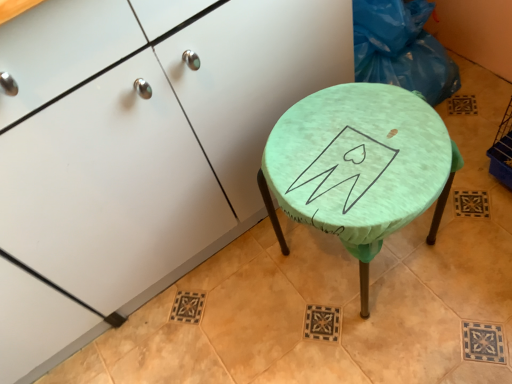
Locate an element on the screen. matte white cabinet at center is located at coordinates (148, 131).

I want to click on matte white cabinet at center, so click(148, 131).

Considering the relative sizes of blue plastic bag at upper right and green fabric-covered stool at center in the image provided, is blue plastic bag at upper right shorter than green fabric-covered stool at center?

Yes.

Is blue plastic bag at upper right inside or outside of green fabric-covered stool at center?

blue plastic bag at upper right is outside green fabric-covered stool at center.

From a real-world perspective, between blue plastic bag at upper right and green fabric-covered stool at center, who is vertically higher?

blue plastic bag at upper right.

This screenshot has height=384, width=512. Find the location of `garbage that is on the right side of matte white cabinet at center`. garbage that is on the right side of matte white cabinet at center is located at coordinates (401, 49).

Is blue plastic bag at upper right directly adjacent to matte white cabinet at center?

No, blue plastic bag at upper right is not touching matte white cabinet at center.

Is blue plastic bag at upper right bigger or smaller than matte white cabinet at center?

Considering their sizes, blue plastic bag at upper right takes up less space than matte white cabinet at center.

Is blue plastic bag at upper right positioned behind matte white cabinet at center?

Yes.

Considering the sizes of objects green fabric-covered stool at center and blue plastic bag at upper right in the image provided, who is thinner, green fabric-covered stool at center or blue plastic bag at upper right?

blue plastic bag at upper right.

Based on the photo, between green fabric-covered stool at center and blue plastic bag at upper right, which one has smaller size?

blue plastic bag at upper right is smaller.

Does point (393, 193) come in front of point (432, 75)?

Yes.

Is green fabric-covered stool at center facing towards blue plastic bag at upper right?

No, green fabric-covered stool at center does not turn towards blue plastic bag at upper right.

From a real-world perspective, between matte white cabinet at center and blue plastic bag at upper right, who is vertically lower?

In real-world perspective, blue plastic bag at upper right is lower.

Considering the sizes of objects matte white cabinet at center and blue plastic bag at upper right in the image provided, who is shorter, matte white cabinet at center or blue plastic bag at upper right?

blue plastic bag at upper right.

Considering their positions, is matte white cabinet at center located in front of or behind blue plastic bag at upper right?

matte white cabinet at center is in front of blue plastic bag at upper right.

Can you confirm if green fabric-covered stool at center is wider than matte white cabinet at center?

Incorrect, the width of green fabric-covered stool at center does not surpass that of matte white cabinet at center.

Can you confirm if green fabric-covered stool at center is shorter than matte white cabinet at center?

Indeed, green fabric-covered stool at center has a lesser height compared to matte white cabinet at center.

From a real-world perspective, between green fabric-covered stool at center and matte white cabinet at center, who is vertically lower?

green fabric-covered stool at center, from a real-world perspective.

From the image's perspective, is green fabric-covered stool at center located above or below matte white cabinet at center?

green fabric-covered stool at center is below matte white cabinet at center.

Is matte white cabinet at center bigger than green fabric-covered stool at center?

Correct, matte white cabinet at center is larger in size than green fabric-covered stool at center.

Consider the image. Considering the relative positions of matte white cabinet at center and green fabric-covered stool at center in the image provided, is matte white cabinet at center to the right of green fabric-covered stool at center from the viewer's perspective?

In fact, matte white cabinet at center is to the left of green fabric-covered stool at center.

Would you consider matte white cabinet at center to be distant from green fabric-covered stool at center?

They are positioned close to each other.

From a real-world perspective, between matte white cabinet at center and green fabric-covered stool at center, who is vertically higher?

matte white cabinet at center is physically above.

In order to click on garbage that is above the green fabric-covered stool at center (from a real-world perspective) in this screenshot , I will do `click(401, 49)`.

I want to click on cabinetry in front of the blue plastic bag at upper right, so click(148, 131).

When comparing their distances from blue plastic bag at upper right, does green fabric-covered stool at center or matte white cabinet at center seem closer?

Based on the image, green fabric-covered stool at center appears to be nearer to blue plastic bag at upper right.

Estimate the real-world distances between objects in this image. Which object is closer to blue plastic bag at upper right, matte white cabinet at center or green fabric-covered stool at center?

Among the two, green fabric-covered stool at center is located nearer to blue plastic bag at upper right.

Estimate the real-world distances between objects in this image. Which object is further from matte white cabinet at center, blue plastic bag at upper right or green fabric-covered stool at center?

blue plastic bag at upper right is further to matte white cabinet at center.

Looking at the image, which one is located further to green fabric-covered stool at center, matte white cabinet at center or blue plastic bag at upper right?

Based on the image, blue plastic bag at upper right appears to be further to green fabric-covered stool at center.

Which object lies nearer to the anchor point matte white cabinet at center, green fabric-covered stool at center or blue plastic bag at upper right?

Among the two, green fabric-covered stool at center is located nearer to matte white cabinet at center.

When comparing their distances from green fabric-covered stool at center, does blue plastic bag at upper right or matte white cabinet at center seem closer?

Based on the image, matte white cabinet at center appears to be nearer to green fabric-covered stool at center.

The width and height of the screenshot is (512, 384). I want to click on stool between matte white cabinet at center and blue plastic bag at upper right in the horizontal direction, so click(x=359, y=166).